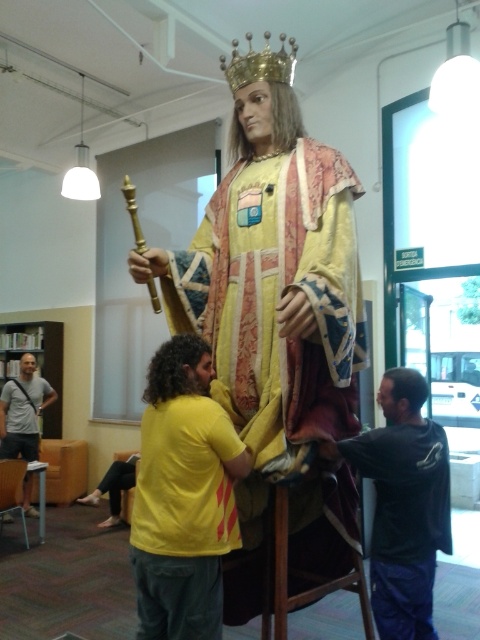
Question: Which of the following is the closest to the observer?

Choices:
 (A) gold metallic crown at upper center
 (B) dark gray sweatshirt at center

Answer: (B)

Question: Does dark gray sweatshirt at center appear under light gray t-shirt at left?

Choices:
 (A) yes
 (B) no

Answer: (B)

Question: Based on their relative distances, which object is nearer to the light gray t-shirt at left?

Choices:
 (A) dark gray sweatshirt at center
 (B) yellow matte shirt at center
 (C) gold textured fabric at center
 (D) gold metallic crown at upper center

Answer: (B)

Question: Which of the following is the closest to the observer?

Choices:
 (A) (275, 76)
 (B) (374, 605)
 (C) (35, 378)

Answer: (A)

Question: Where is dark gray sweatshirt at center located in relation to gold metallic crown at upper center in the image?

Choices:
 (A) left
 (B) right

Answer: (B)

Question: Does gold textured fabric at center appear on the left side of yellow matte shirt at center?

Choices:
 (A) no
 (B) yes

Answer: (A)